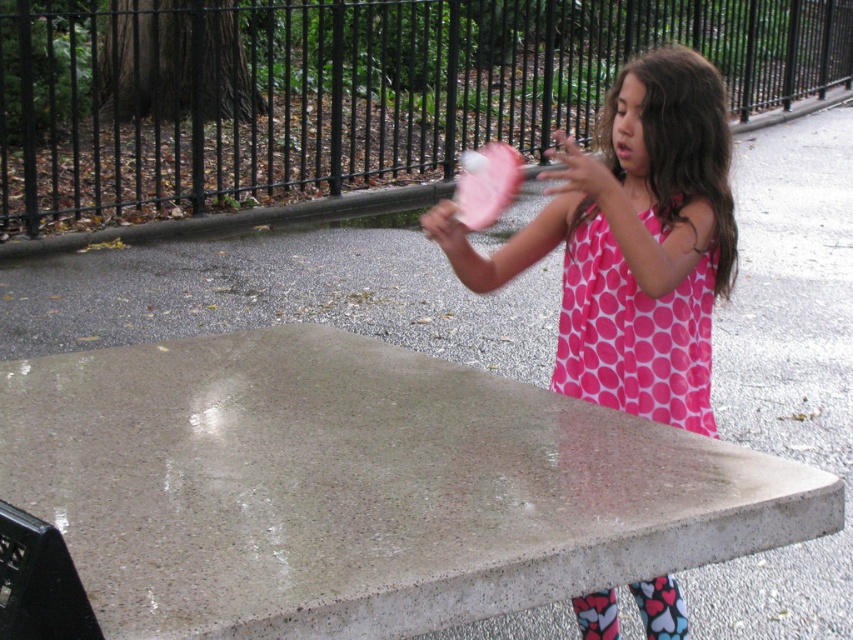
The width and height of the screenshot is (853, 640). What do you see at coordinates (363, 486) in the screenshot? I see `concrete picnic table at center` at bounding box center [363, 486].

Does point (741, 492) lie behind point (566, 326)?

That is False.

The height and width of the screenshot is (640, 853). What are the coordinates of `concrete picnic table at center` in the screenshot? It's located at (363, 486).

Does concrete picnic table at center have a lesser width compared to pink dotted dress at center?

No.

Who is lower down, concrete picnic table at center or pink dotted dress at center?

concrete picnic table at center is below.

Who is more forward, (x=723, y=541) or (x=695, y=380)?

Point (x=723, y=541) is in front.

The width and height of the screenshot is (853, 640). In order to click on concrete picnic table at center in this screenshot , I will do `click(363, 486)`.

Between pink dotted dress at center and pink dotted fabric dress at upper right, which one has less height?

With less height is pink dotted fabric dress at upper right.

What are the coordinates of `pink dotted dress at center` in the screenshot? It's located at (631, 243).